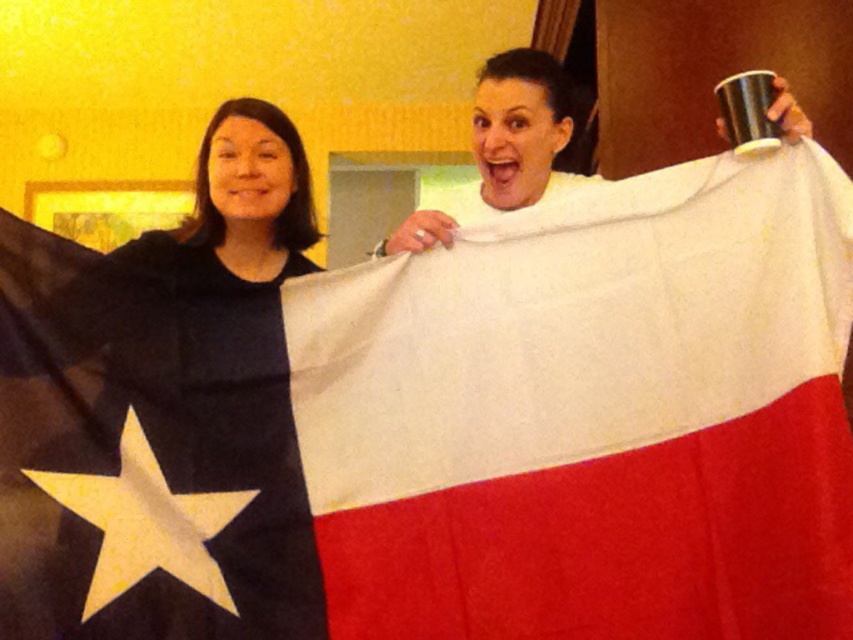
Which is more to the right, matte black shirt at left or white matte cup at upper center?

Positioned to the right is white matte cup at upper center.

Is matte black shirt at left smaller than white matte cup at upper center?

Indeed, matte black shirt at left has a smaller size compared to white matte cup at upper center.

Which is behind, point (219, 250) or point (521, 188)?

The point (521, 188) is more distant.

Where is `matte black shirt at left`? This screenshot has height=640, width=853. matte black shirt at left is located at coordinates (248, 196).